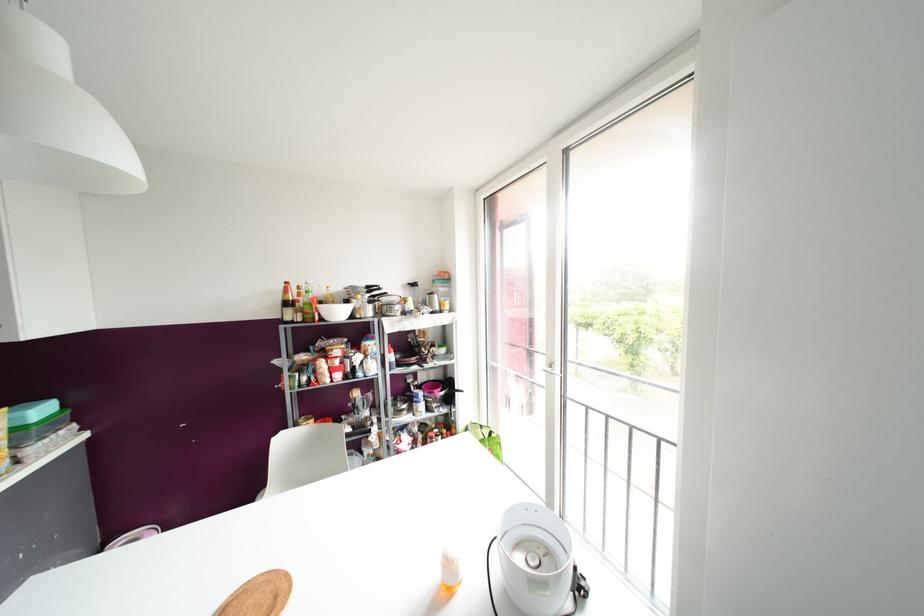
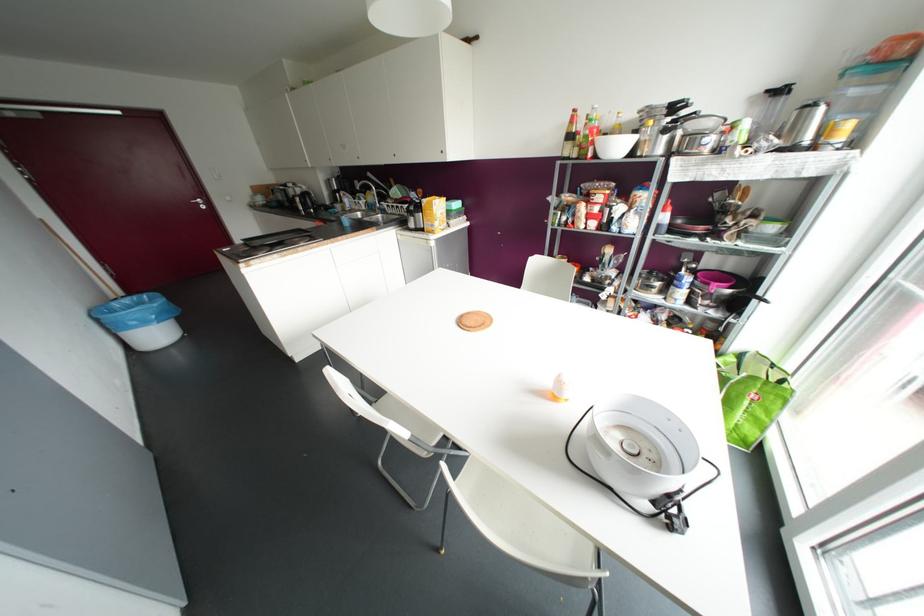
The point at (369, 288) is marked in the first image. Where is the corresponding point in the second image?

(673, 107)